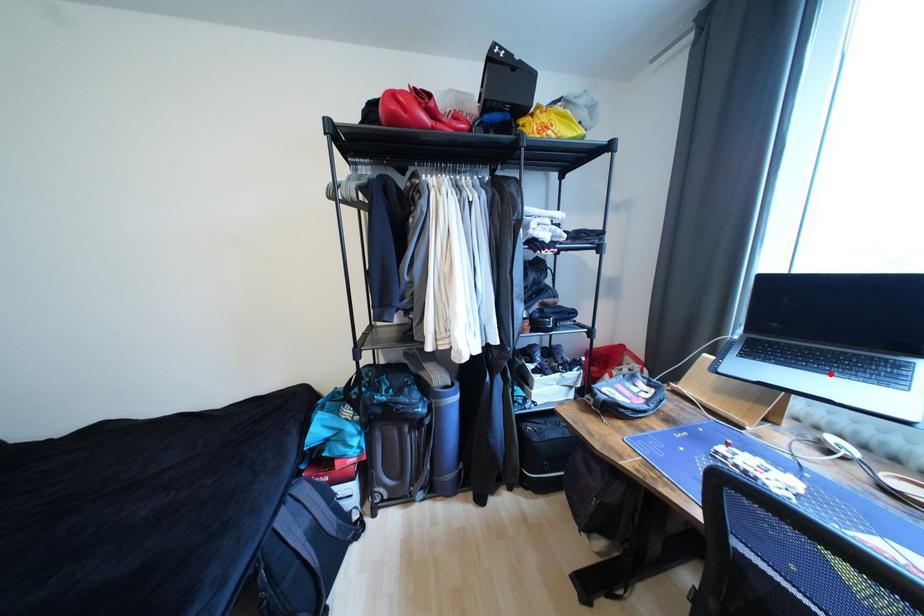
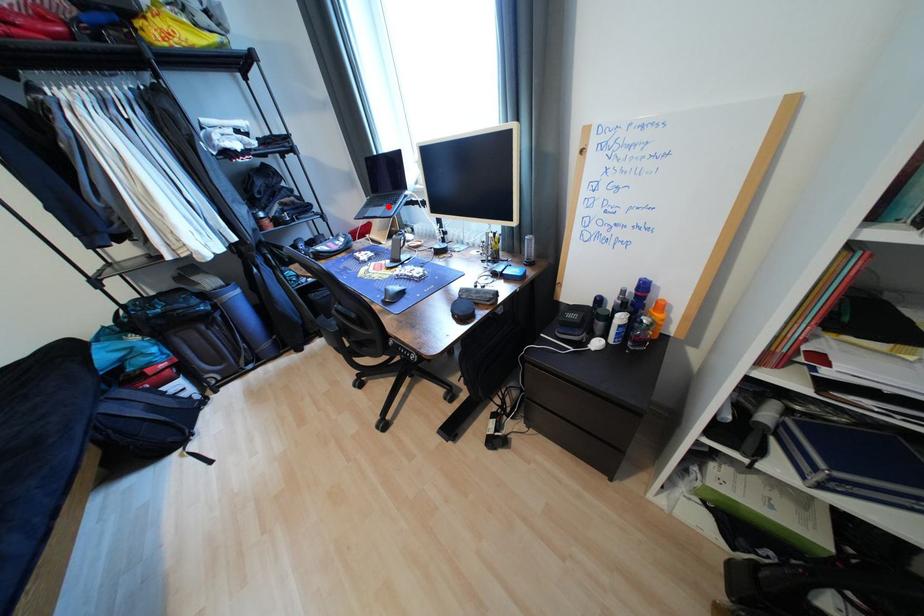
I am providing you with two images of the same scene from different viewpoints. A red point is marked on the first image and another point is marked on the second image. Are the points marked in image1 and image2 representing the same 3D position?

Yes